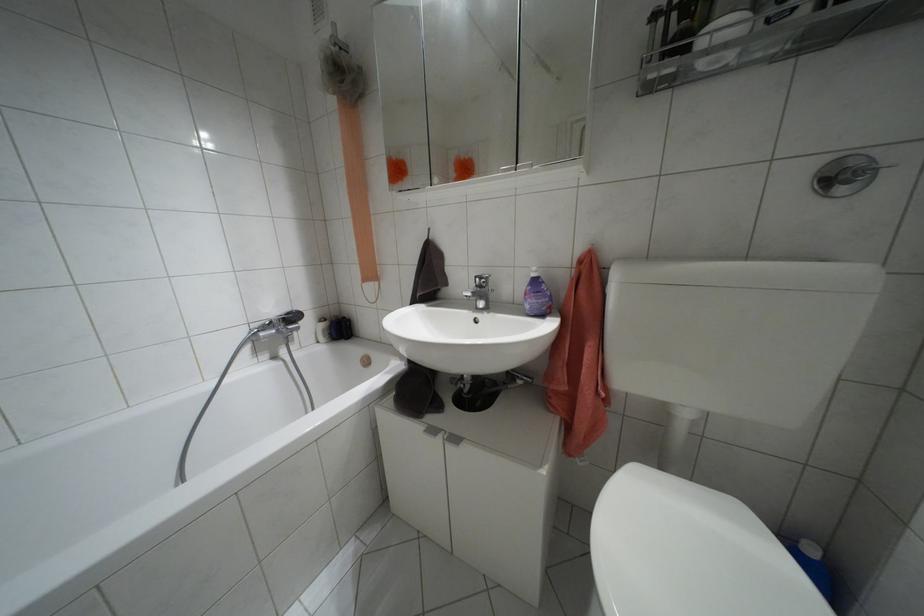
Locate an element on the screen. The width and height of the screenshot is (924, 616). sink faucet handle is located at coordinates (481, 280).